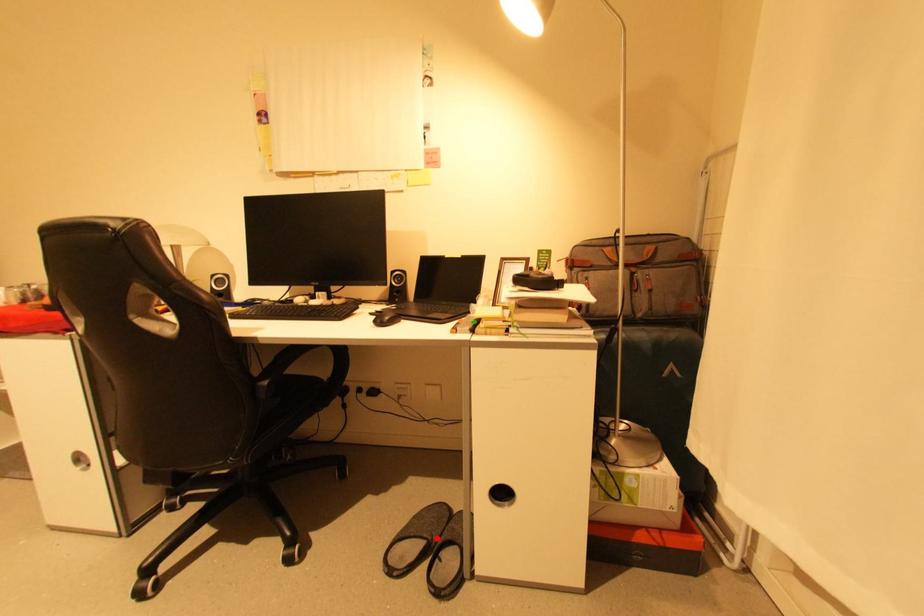
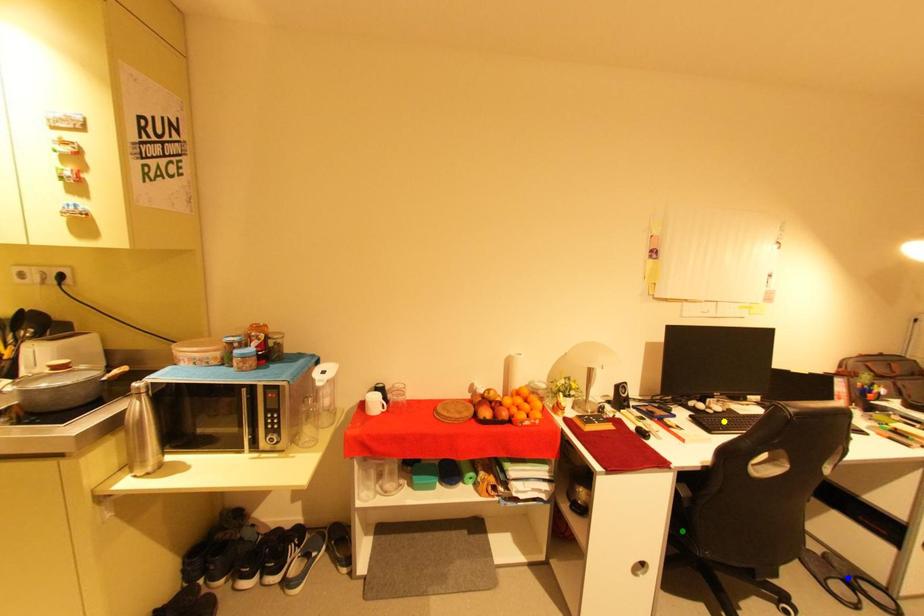
Question: I am providing you with two images of the same scene from different viewpoints. A red point is marked on the first image. You are given multiple points on the second image. Which mark in image 2 goes with the point in image 1?

Choices:
 (A) green point
 (B) yellow point
 (C) blue point

Answer: (C)